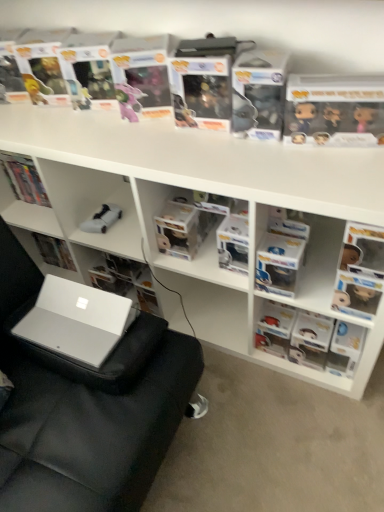
What is the approximate width of clear plastic book at upper center, the 2th paperback book when ordered from right to left?

clear plastic book at upper center, the 2th paperback book when ordered from right to left, is 6.30 inches wide.

Locate an element on the screen. This screenshot has width=384, height=512. white matte book at center, arranged as the first book when viewed from the left is located at coordinates (126, 281).

What do you see at coordinates (102, 219) in the screenshot? The image size is (384, 512). I see `white matte remote control at center` at bounding box center [102, 219].

Locate an element on the screen. The width and height of the screenshot is (384, 512). matte black figurine at upper right, which is the 2th paperback book from left to right is located at coordinates (335, 109).

Where is `the 1st paperback book above the silver metallic laptop at lower left (from a real-world perspective)`? Image resolution: width=384 pixels, height=512 pixels. the 1st paperback book above the silver metallic laptop at lower left (from a real-world perspective) is located at coordinates (335, 109).

From a real-world perspective, is silver metallic laptop at lower left on top of matte black figurine at upper right, which is the 2th paperback book from left to right?

Incorrect, from a real-world perspective, silver metallic laptop at lower left is lower than matte black figurine at upper right, which is the 2th paperback book from left to right.

From the image's perspective, is silver metallic laptop at lower left beneath matte black figurine at upper right, which is the 2th paperback book from left to right?

Indeed, from the image's perspective, silver metallic laptop at lower left is shown beneath matte black figurine at upper right, which is the 2th paperback book from left to right.

Considering the sizes of objects silver metallic laptop at lower left and matte black figurine at upper right, which is the 2th paperback book from left to right, in the image provided, who is thinner, silver metallic laptop at lower left or matte black figurine at upper right, which is the 2th paperback book from left to right,?

Thinner between the two is matte black figurine at upper right, which is the 2th paperback book from left to right.

From a real-world perspective, who is located higher, matte black figurine at upper right, the first paperback book from the right, or white plastic shelves at upper center?

matte black figurine at upper right, the first paperback book from the right, is physically above.

In terms of size, does matte black figurine at upper right, the first paperback book from the right, appear bigger or smaller than white plastic shelves at upper center?

Considering their sizes, matte black figurine at upper right, the first paperback book from the right, takes up less space than white plastic shelves at upper center.

Is white plastic shelves at upper center located within matte black figurine at upper right, which is the 2th paperback book from left to right?

Definitely not — white plastic shelves at upper center is not inside matte black figurine at upper right, which is the 2th paperback book from left to right.

Between matte black figurine at upper right, the first paperback book from the right, and white plastic shelves at upper center, which one appears on the left side from the viewer's perspective?

Answer: From the viewer's perspective, white plastic shelves at upper center appears more on the left side.

The image size is (384, 512). What are the coordinates of `book above the white plastic shelves at upper center (from the image's perspective)` in the screenshot? It's located at (187, 222).

From a real-world perspective, between white plastic shelves at upper center and clear plastic container at center, positioned as the 2th book in right-to-left order, who is vertically lower?

white plastic shelves at upper center is physically lower.

Is white plastic shelves at upper center behind clear plastic container at center, positioned as the 2th book in right-to-left order?

No, white plastic shelves at upper center is in front of clear plastic container at center, positioned as the 2th book in right-to-left order.

Is white plastic shelves at upper center turned away from clear plastic container at center, the second book viewed from the left?

Correct, white plastic shelves at upper center is looking away from clear plastic container at center, the second book viewed from the left.

Does white plastic shelves at upper center have a greater height compared to matte plastic figurine at right, arranged as the 1th book when viewed from the right?

Yes.

Is matte plastic figurine at right, arranged as the 1th book when viewed from the right, at the back of white plastic shelves at upper center?

Yes, white plastic shelves at upper center is facing away from matte plastic figurine at right, arranged as the 1th book when viewed from the right.

From the image's perspective, which one is positioned higher, white plastic shelves at upper center or matte plastic figurine at right, placed as the third book when sorted from left to right?

white plastic shelves at upper center appears higher in the image.

Considering the sizes of silver metallic swivel chair at lower left and matte plastic figurine at right, placed as the third book when sorted from left to right, in the image, is silver metallic swivel chair at lower left taller or shorter than matte plastic figurine at right, placed as the third book when sorted from left to right,?

silver metallic swivel chair at lower left is taller than matte plastic figurine at right, placed as the third book when sorted from left to right.

Which is behind, point (133, 372) or point (330, 369)?

The point (330, 369) is more distant.

Are silver metallic swivel chair at lower left and matte plastic figurine at right, placed as the third book when sorted from left to right, making contact?

silver metallic swivel chair at lower left and matte plastic figurine at right, placed as the third book when sorted from left to right, are clearly separated.

From a real-world perspective, is silver metallic swivel chair at lower left below matte plastic figurine at right, placed as the third book when sorted from left to right?

Actually, silver metallic swivel chair at lower left is physically above matte plastic figurine at right, placed as the third book when sorted from left to right, in the real world.

Is point (224, 65) behind point (124, 362)?

Yes, point (224, 65) is behind point (124, 362).

Does clear plastic book at upper center, the 2th paperback book when ordered from right to left, touch silver metallic swivel chair at lower left?

There is a gap between clear plastic book at upper center, the 2th paperback book when ordered from right to left, and silver metallic swivel chair at lower left.

Measure the distance from clear plastic book at upper center, placed as the first paperback book when sorted from left to right, to silver metallic swivel chair at lower left.

clear plastic book at upper center, placed as the first paperback book when sorted from left to right, is 30.20 inches from silver metallic swivel chair at lower left.

From the image's perspective, would you say clear plastic book at upper center, placed as the first paperback book when sorted from left to right, is positioned over silver metallic swivel chair at lower left?

Correct, clear plastic book at upper center, placed as the first paperback book when sorted from left to right, appears higher than silver metallic swivel chair at lower left in the image.

Is silver metallic swivel chair at lower left oriented towards silver metallic laptop at lower left?

Yes, silver metallic swivel chair at lower left is turned towards silver metallic laptop at lower left.

Does silver metallic swivel chair at lower left have a greater width compared to silver metallic laptop at lower left?

Indeed, silver metallic swivel chair at lower left has a greater width compared to silver metallic laptop at lower left.

Is silver metallic swivel chair at lower left bigger or smaller than silver metallic laptop at lower left?

Considering their sizes, silver metallic swivel chair at lower left takes up more space than silver metallic laptop at lower left.

In order to click on the 2nd paperback book counting from the right side of the silver metallic laptop at lower left in this screenshot , I will do `click(335, 109)`.

I want to click on bookshelf below the matte black figurine at upper right, which is the 2th paperback book from left to right (from a real-world perspective), so click(x=212, y=233).

From the image, which object appears to be farther from white plastic shelves at upper center, clear plastic book at upper center, placed as the first paperback book when sorted from left to right, or clear plastic container at center, the second book viewed from the left?

The object further to white plastic shelves at upper center is clear plastic book at upper center, placed as the first paperback book when sorted from left to right.

Based on the photo, which object lies further to the anchor point white plastic shelves at upper center, clear plastic container at center, positioned as the 2th book in right-to-left order, or matte black figurine at upper right, the first paperback book from the right?

Based on the image, matte black figurine at upper right, the first paperback book from the right, appears to be further to white plastic shelves at upper center.

Which object lies nearer to the anchor point white matte book at center, the third book in the right-to-left sequence, silver metallic swivel chair at lower left or clear plastic book at upper center, placed as the first paperback book when sorted from left to right?

The object closer to white matte book at center, the third book in the right-to-left sequence, is silver metallic swivel chair at lower left.

Which object lies nearer to the anchor point white matte book at center, arranged as the first book when viewed from the left, clear plastic book at upper center, the 2th paperback book when ordered from right to left, or white plastic shelves at upper center?

The object closer to white matte book at center, arranged as the first book when viewed from the left, is white plastic shelves at upper center.

When comparing their distances from silver metallic swivel chair at lower left, does white matte book at center, arranged as the first book when viewed from the left, or white matte remote control at center seem further?

Among the two, white matte remote control at center is located further to silver metallic swivel chair at lower left.

In the scene shown: Looking at the image, which one is located closer to clear plastic book at upper center, the 2th paperback book when ordered from right to left, white matte remote control at center or clear plastic container at center, the second book viewed from the left?

Among the two, clear plastic container at center, the second book viewed from the left, is located nearer to clear plastic book at upper center, the 2th paperback book when ordered from right to left.

Estimate the real-world distances between objects in this image. Which object is further from white plastic shelves at upper center, silver metallic swivel chair at lower left or clear plastic book at upper center, the 2th paperback book when ordered from right to left?

silver metallic swivel chair at lower left.

Based on their spatial positions, is silver metallic laptop at lower left or matte black figurine at upper right, the first paperback book from the right, closer to white matte remote control at center?

silver metallic laptop at lower left is positioned closer to the anchor white matte remote control at center.

This screenshot has height=512, width=384. What are the coordinates of `paperback book situated between white matte remote control at center and matte black figurine at upper right, the first paperback book from the right, from left to right` in the screenshot? It's located at (201, 92).

The height and width of the screenshot is (512, 384). I want to click on bookshelf between white matte book at center, the third book in the right-to-left sequence, and matte plastic figurine at right, arranged as the 1th book when viewed from the right, so click(212, 233).

At what (x,y) coordinates should I click in order to perform the action: click on toy between clear plastic book at upper center, the 2th paperback book when ordered from right to left, and white matte book at center, the third book in the right-to-left sequence, vertically. Please return your answer as a coordinate pair (x, y). Image resolution: width=384 pixels, height=512 pixels. Looking at the image, I should click on (102, 219).

Find the location of a particular element. This screenshot has height=512, width=384. bookshelf between silver metallic swivel chair at lower left and matte plastic figurine at right, arranged as the 1th book when viewed from the right is located at coordinates (212, 233).